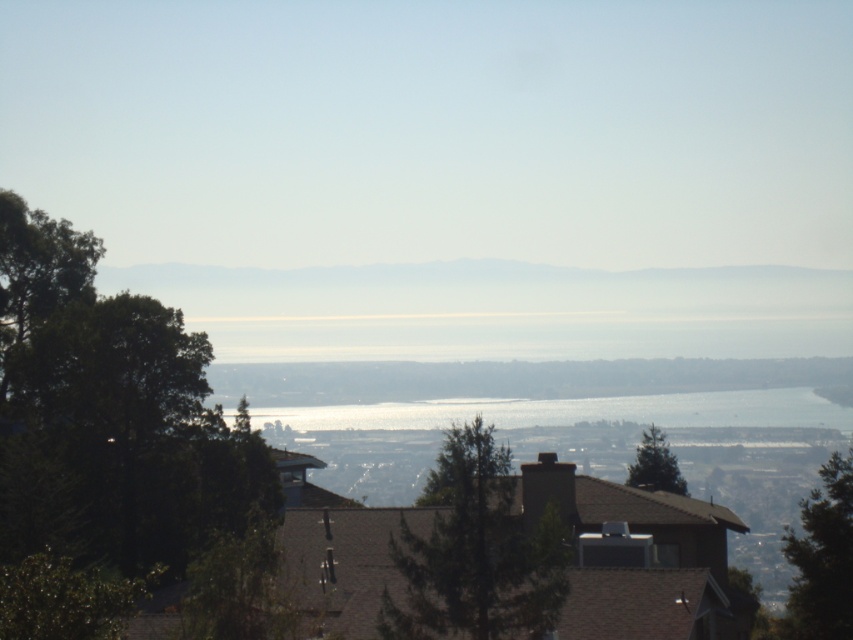
You are standing at the center of the image and want to walk towards the green leafy tree at left. Which direction should you face to head directly towards it?

The green leafy tree at left is located at point coordinates, so you should face towards the left direction to head directly towards it.